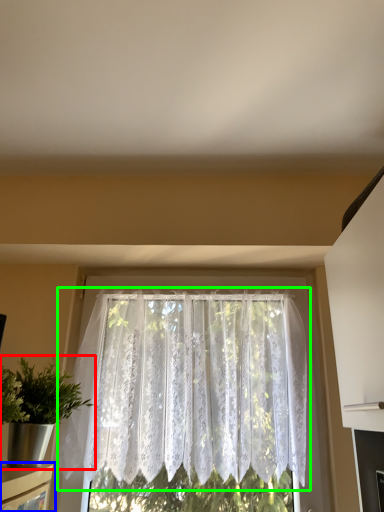
Question: Considering the real-world distances, which object is farthest from houseplant (highlighted by a red box)? shelf (highlighted by a blue box) or window (highlighted by a green box)?

Choices:
 (A) shelf
 (B) window

Answer: (B)